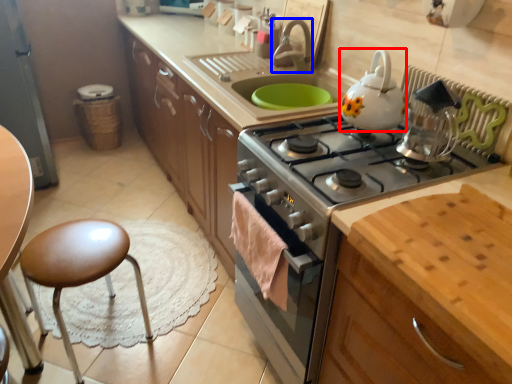
Question: Which object is closer to the camera taking this photo, kitchen appliance (highlighted by a red box) or faucet (highlighted by a blue box)?

Choices:
 (A) kitchen appliance
 (B) faucet

Answer: (A)